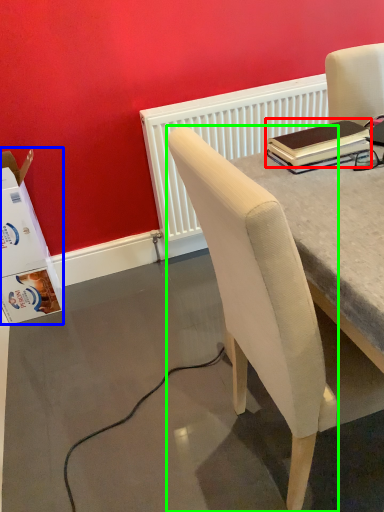
Question: Which is farther away from notebook (highlighted by a red box)? box (highlighted by a blue box) or chair (highlighted by a green box)?

Choices:
 (A) box
 (B) chair

Answer: (A)